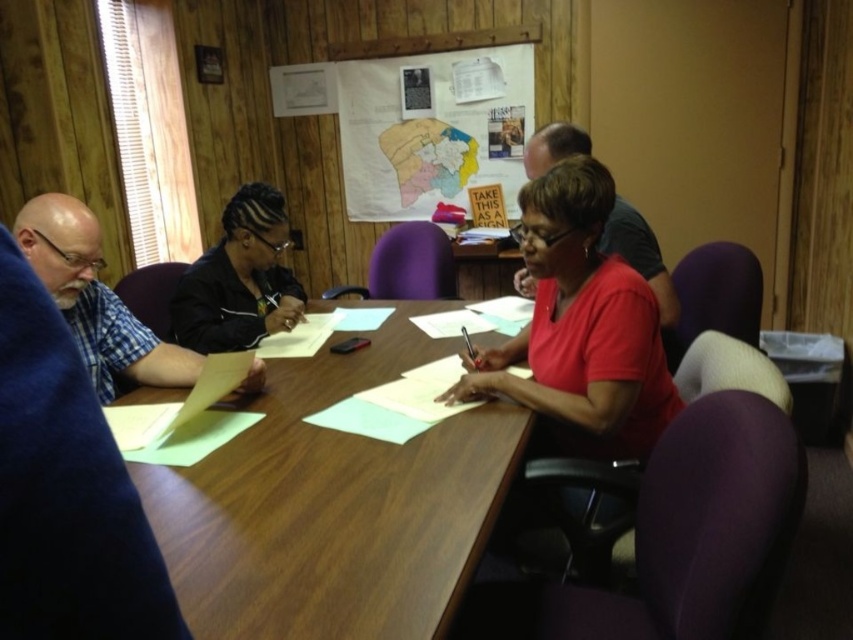
Question: Which object appears farthest from the camera in this image?

Choices:
 (A) wooden table at center
 (B) blue plaid shirt at left

Answer: (B)

Question: Can you confirm if wooden table at center is positioned below black matte jacket at center?

Choices:
 (A) no
 (B) yes

Answer: (B)

Question: Which object appears closest to the camera in this image?

Choices:
 (A) black matte jacket at center
 (B) matte red shirt at center

Answer: (B)

Question: Which of the following is the farthest from the observer?

Choices:
 (A) (421, 196)
 (B) (527, 344)

Answer: (A)

Question: Does paper map at upper center come behind matte black shirt at upper center?

Choices:
 (A) no
 (B) yes

Answer: (B)

Question: Does blue plaid shirt at left lie behind matte black shirt at upper center?

Choices:
 (A) yes
 (B) no

Answer: (B)